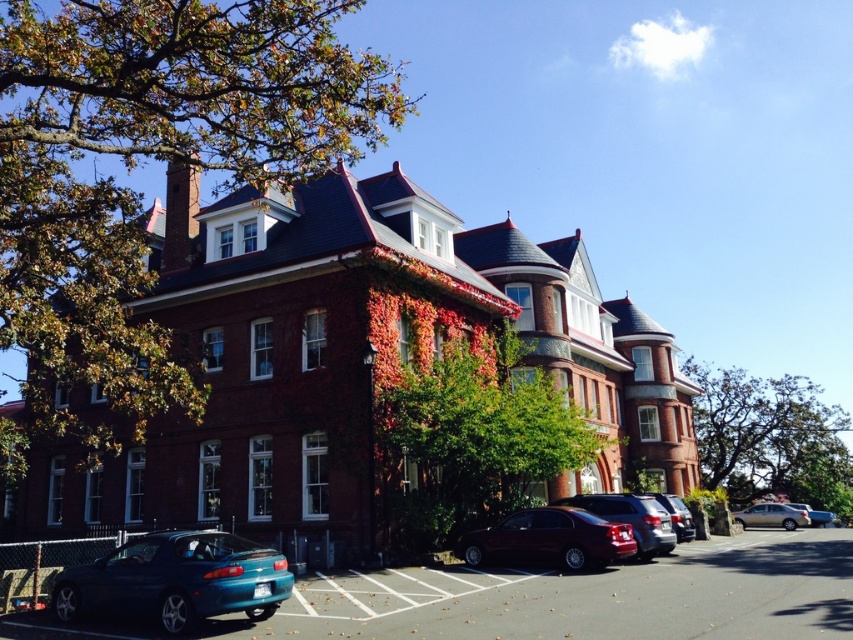
You are standing at the camera position and want to take a photo of the green leafy tree at right. The camera has a maximum focus range of 200 feet. Will the camera be able to focus on the tree?

The green leafy tree at right and camera are 212.42 feet apart from each other, so the camera cannot focus on the tree since it is beyond the maximum focus range of 200 feet.

In the scene shown: You are standing at the entrance of the Victorian building and want to park your shiny dark red sedan at lower center. The parking spot you want is located at coordinate point 0.844, 0.645. Is your car currently in the correct parking spot?

The shiny dark red sedan at lower center is located at point (549, 540), so yes, it is parked in the correct parking spot.